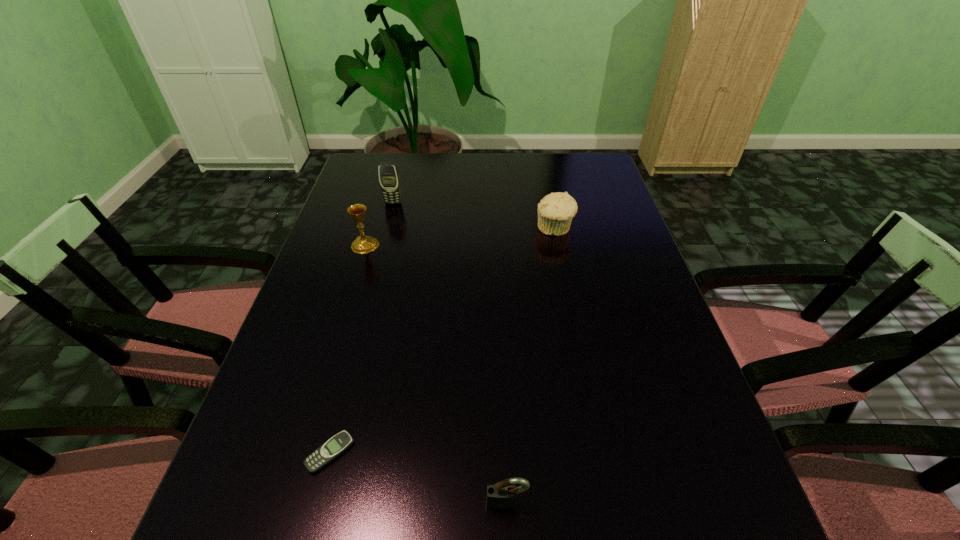
The image size is (960, 540). What are the coordinates of `cellular telephone` in the screenshot? It's located at (389, 179).

Identify the location of chalice. (362, 244).

The image size is (960, 540). What are the coordinates of `the rightmost object` in the screenshot? It's located at (555, 211).

This screenshot has width=960, height=540. I want to click on the second shortest object, so click(502, 495).

This screenshot has height=540, width=960. I want to click on padlock, so click(x=502, y=495).

Where is `beeper`? Image resolution: width=960 pixels, height=540 pixels. beeper is located at coordinates (330, 450).

You are a GUI agent. You are given a task and a screenshot of the screen. Output one action in this format:
    pyautogui.click(x=<x>, y=<y>)
    Task: Click on the shortest object
    
    Given the screenshot: What is the action you would take?
    pyautogui.click(x=330, y=450)

Find the location of a particular element. vacant area situated on the front face of the farthest object is located at coordinates [371, 291].

Where is `free space located on the back of the chalice`? free space located on the back of the chalice is located at coordinates (374, 214).

Find the location of `blank area located on the right of the rightmost object`. blank area located on the right of the rightmost object is located at coordinates (612, 228).